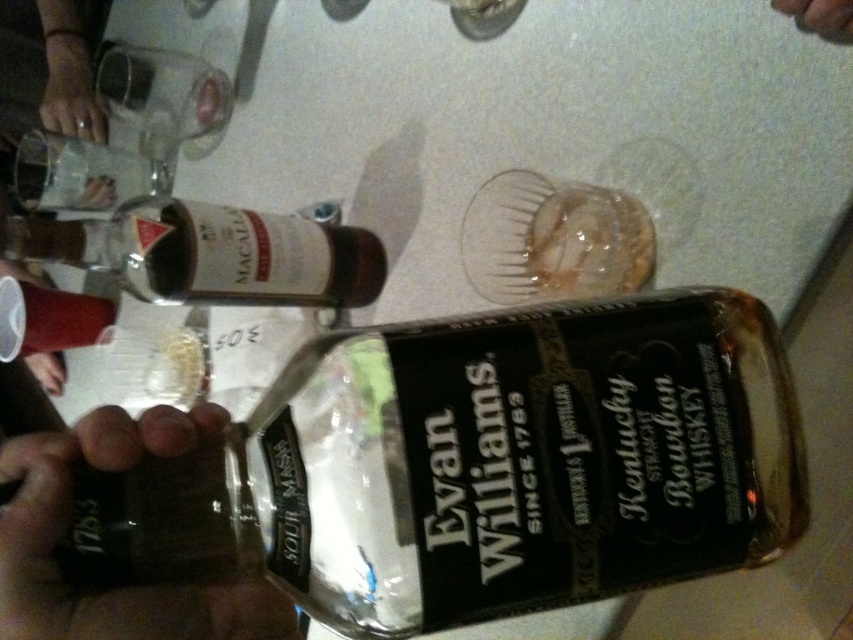
You have a small coaster and want to place it under the clear glass bottle at center and the matte plastic cup at lower left. Which object requires a larger coaster to fully cover its base?

The clear glass bottle at center requires a larger coaster since its width is greater than the matte plastic cup at lower left.

You are at a party and want to pour the water from the translucent plastic cup at lower left into the clear glass bottle at upper left. Will the bottle be able to hold all the water from the cup?

The clear glass bottle at upper left might be wider than translucent plastic cup at lower left, but without knowing their heights or the amount of water in the cup, it is impossible to determine if the bottle can hold all the water.